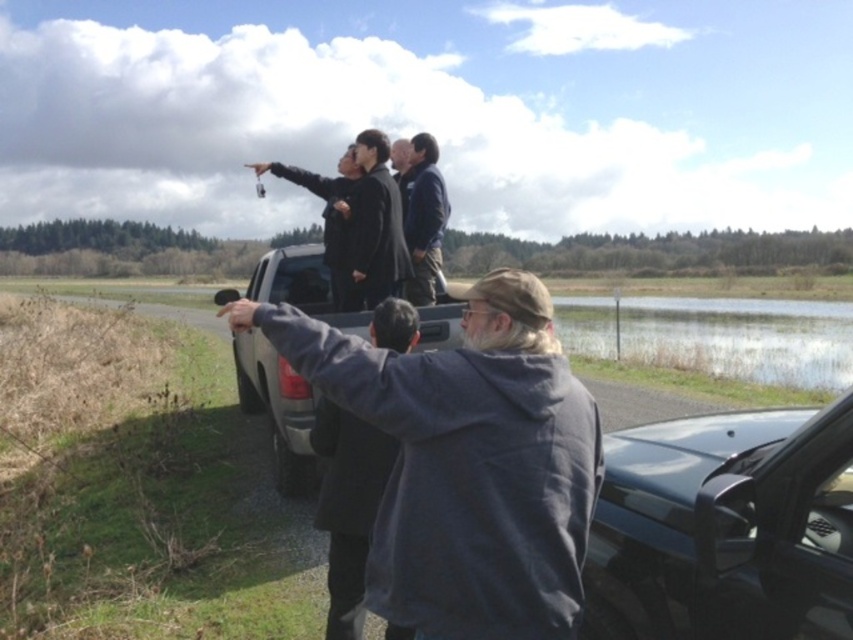
You are a photographer trying to capture the gray matte pickup truck at center and the gray matte truck at center in a single frame. Which one should you focus on first to ensure both are in the frame?

Both objects are the same vehicle, so focusing on either will capture the truck in the frame.

You are a hiker trying to take a photo of the gray matte pickup truck at center and the glossy black car at lower right. Which vehicle should you focus on first if you want to capture both in a single frame without moving your camera?

You should focus on the gray matte pickup truck at center first because it is closer to you than the glossy black car at lower right, so it will appear larger and more prominent in the frame.

You are standing at the center of the image. Which direction should you move to reach the glossy black car at lower right?

You should move towards the lower right direction to reach the glossy black car at lower right since its 2D location is at point (724, 529), which is in the lower right quadrant of the image.